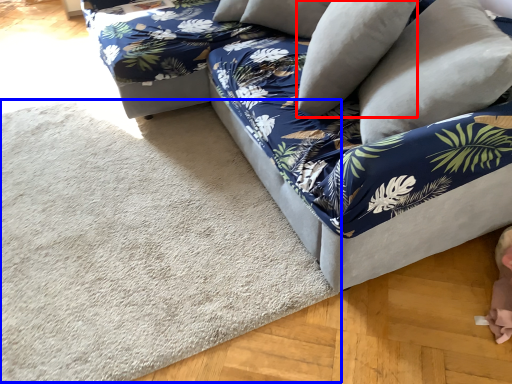
Question: Which object appears closest to the camera in this image, pillow (highlighted by a red box) or mat (highlighted by a blue box)?

Choices:
 (A) pillow
 (B) mat

Answer: (B)